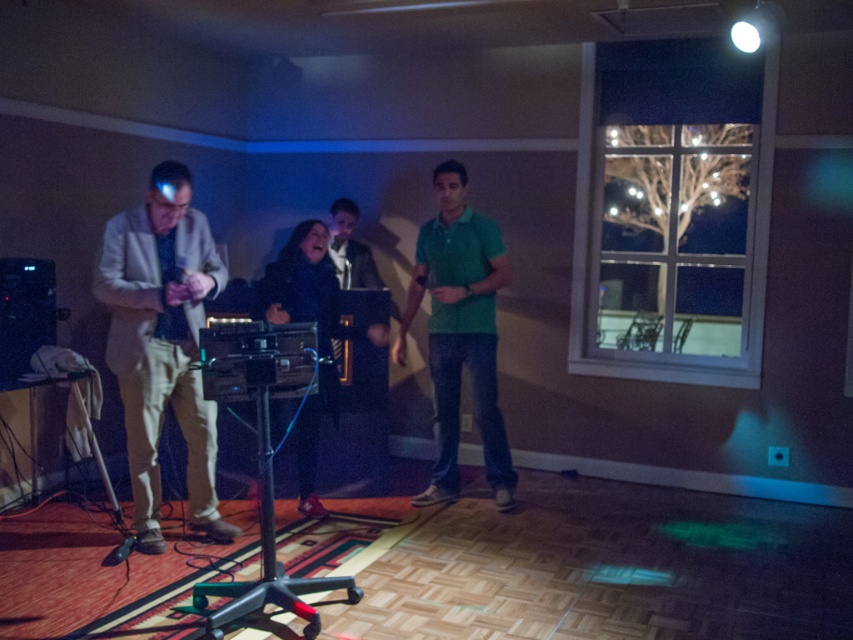
Is point (469, 337) closer to viewer compared to point (265, 320)?

No, (469, 337) is behind (265, 320).

Who is taller, green matte shirt at center or velvet black coat at center?

With more height is green matte shirt at center.

Who is more distant from viewer, (476, 320) or (283, 307)?

Point (476, 320)

The height and width of the screenshot is (640, 853). What are the coordinates of `green matte shirt at center` in the screenshot? It's located at (459, 332).

Who is positioned more to the left, light beige fabric suit at left or velvet black coat at center?

light beige fabric suit at left is more to the left.

Can you confirm if light beige fabric suit at left is smaller than velvet black coat at center?

Actually, light beige fabric suit at left might be larger than velvet black coat at center.

The height and width of the screenshot is (640, 853). I want to click on light beige fabric suit at left, so coord(161,344).

Which of these two, light beige fabric suit at left or green matte shirt at center, stands taller?

green matte shirt at center

Can you confirm if light beige fabric suit at left is positioned to the left of green matte shirt at center?

Correct, you'll find light beige fabric suit at left to the left of green matte shirt at center.

Locate an element on the screen. light beige fabric suit at left is located at coordinates (161, 344).